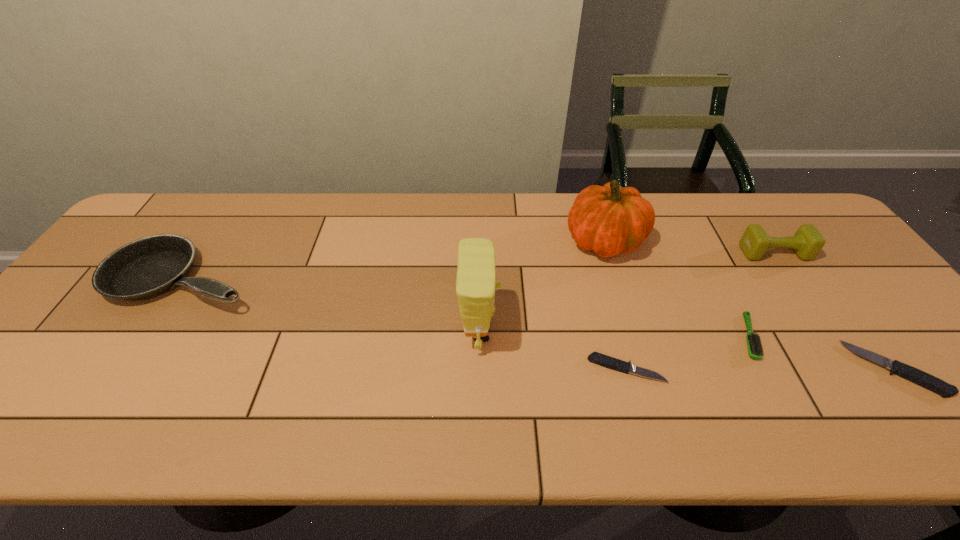
Where is `vacant space that satisfies the following two spatial constraints: 1. on the back side of the pumpkin; 2. on the right side of the shortest object`? The height and width of the screenshot is (540, 960). vacant space that satisfies the following two spatial constraints: 1. on the back side of the pumpkin; 2. on the right side of the shortest object is located at coordinates (591, 241).

Find the location of a particular element. free point that satisfies the following two spatial constraints: 1. on the face of the second object from left to right; 2. on the right side of the left steak knife is located at coordinates (480, 369).

Where is `vacant space that satisfies the following two spatial constraints: 1. on the back side of the frying pan; 2. on the right side of the pumpkin`? vacant space that satisfies the following two spatial constraints: 1. on the back side of the frying pan; 2. on the right side of the pumpkin is located at coordinates (209, 241).

At what (x,y) coordinates should I click in order to perform the action: click on vacant space that satisfies the following two spatial constraints: 1. on the face of the shortest object; 2. on the right side of the sixth object from right to left. Please return your answer as a coordinate pair (x, y). Looking at the image, I should click on (480, 369).

Identify the location of free location that satisfies the following two spatial constraints: 1. on the back side of the third shortest object; 2. on the face of the sponge. (746, 332).

Where is `vacant space that satisfies the following two spatial constraints: 1. on the face of the second object from left to right; 2. on the left side of the shortest object`? This screenshot has height=540, width=960. vacant space that satisfies the following two spatial constraints: 1. on the face of the second object from left to right; 2. on the left side of the shortest object is located at coordinates (480, 369).